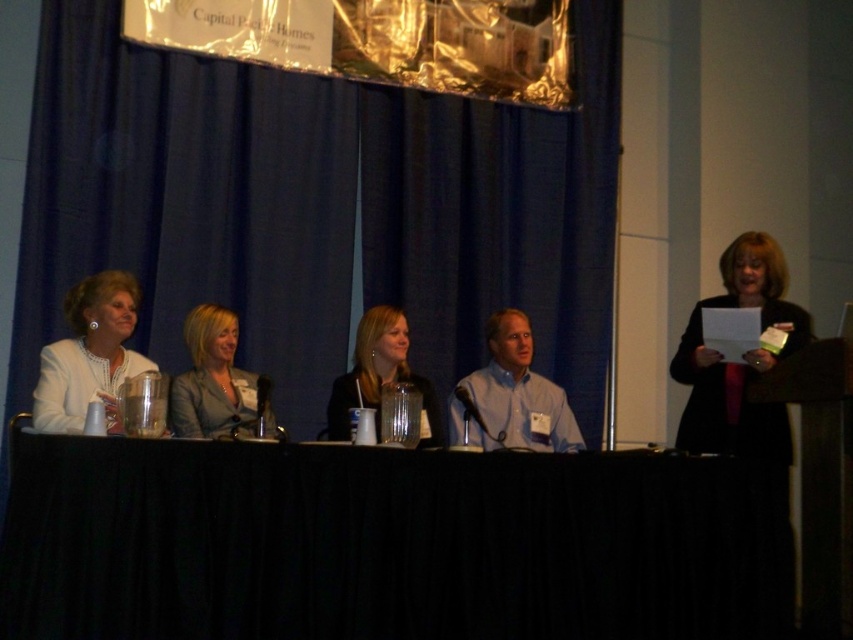
You are organizing a photoshoot and need to place a 1.2 meter wide backdrop behind the blue fabric curtain at upper center and the black fabric dress at right. Based on their positions, will the backdrop be wide enough to cover both objects?

The blue fabric curtain at upper center is positioned on the left side of black fabric dress at right, so the distance between them may require a backdrop wider than 1.2 meters to fully cover both. The provided backdrop might not be sufficient.

You are sitting in the audience and want to point out the light blue shirt at center and the smooth black jacket at center to a friend. Which one is on the right side?

The light blue shirt at center is to the right of smooth black jacket at center.